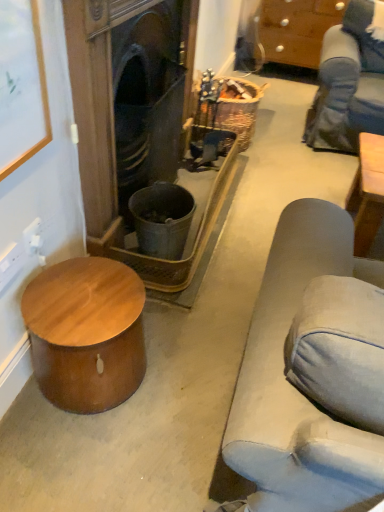
Question: From the image's perspective, is brown wood cabinet at upper right above wooden drum at lower left?

Choices:
 (A) yes
 (B) no

Answer: (A)

Question: From a real-world perspective, does brown wood cabinet at upper right sit lower than wooden drum at lower left?

Choices:
 (A) no
 (B) yes

Answer: (A)

Question: Considering the relative sizes of brown wood cabinet at upper right and wooden drum at lower left in the image provided, is brown wood cabinet at upper right thinner than wooden drum at lower left?

Choices:
 (A) no
 (B) yes

Answer: (A)

Question: Considering the relative sizes of brown wood cabinet at upper right and wooden drum at lower left in the image provided, is brown wood cabinet at upper right smaller than wooden drum at lower left?

Choices:
 (A) yes
 (B) no

Answer: (B)

Question: From a real-world perspective, is brown wood cabinet at upper right over wooden drum at lower left?

Choices:
 (A) yes
 (B) no

Answer: (A)

Question: From the image's perspective, is brown wood cabinet at upper right above or below dark wood fireplace at center?

Choices:
 (A) below
 (B) above

Answer: (B)

Question: Considering the relative positions of brown wood cabinet at upper right and dark wood fireplace at center in the image provided, is brown wood cabinet at upper right to the left or to the right of dark wood fireplace at center?

Choices:
 (A) left
 (B) right

Answer: (B)

Question: Do you think brown wood cabinet at upper right is within dark wood fireplace at center, or outside of it?

Choices:
 (A) outside
 (B) inside

Answer: (A)

Question: Considering the positions of brown wood cabinet at upper right and dark wood fireplace at center in the image, is brown wood cabinet at upper right taller or shorter than dark wood fireplace at center?

Choices:
 (A) short
 (B) tall

Answer: (A)

Question: Based on their sizes in the image, would you say wooden picture frame at upper left is bigger or smaller than dark wood fireplace at center?

Choices:
 (A) small
 (B) big

Answer: (A)

Question: In terms of width, does wooden picture frame at upper left look wider or thinner when compared to dark wood fireplace at center?

Choices:
 (A) wide
 (B) thin

Answer: (B)

Question: Is wooden picture frame at upper left taller or shorter than dark wood fireplace at center?

Choices:
 (A) tall
 (B) short

Answer: (B)

Question: Would you say wooden picture frame at upper left is to the left or to the right of dark wood fireplace at center in the picture?

Choices:
 (A) left
 (B) right

Answer: (A)

Question: Is dark wood fireplace at center bigger or smaller than wooden picture frame at upper left?

Choices:
 (A) big
 (B) small

Answer: (A)

Question: Is dark wood fireplace at center situated inside wooden picture frame at upper left or outside?

Choices:
 (A) outside
 (B) inside

Answer: (A)